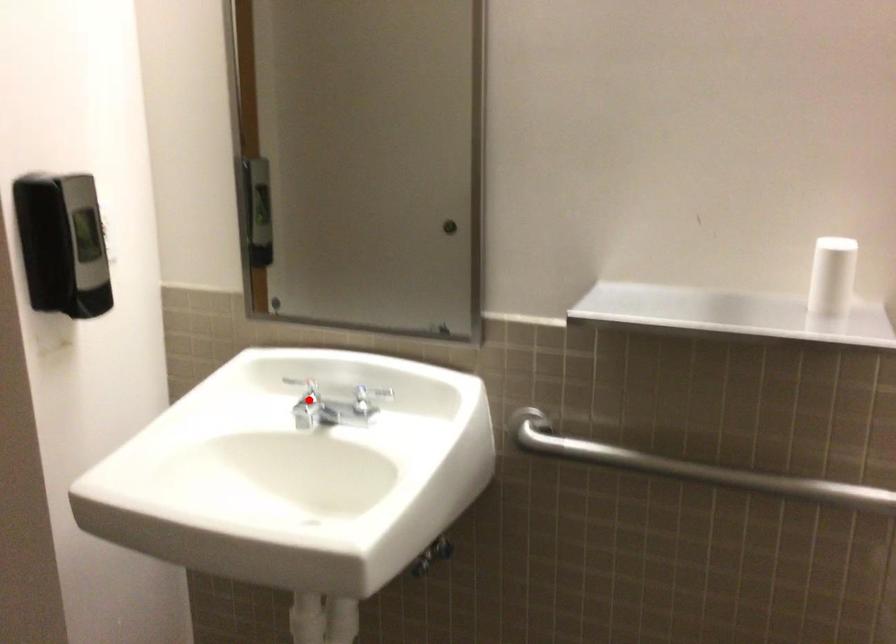
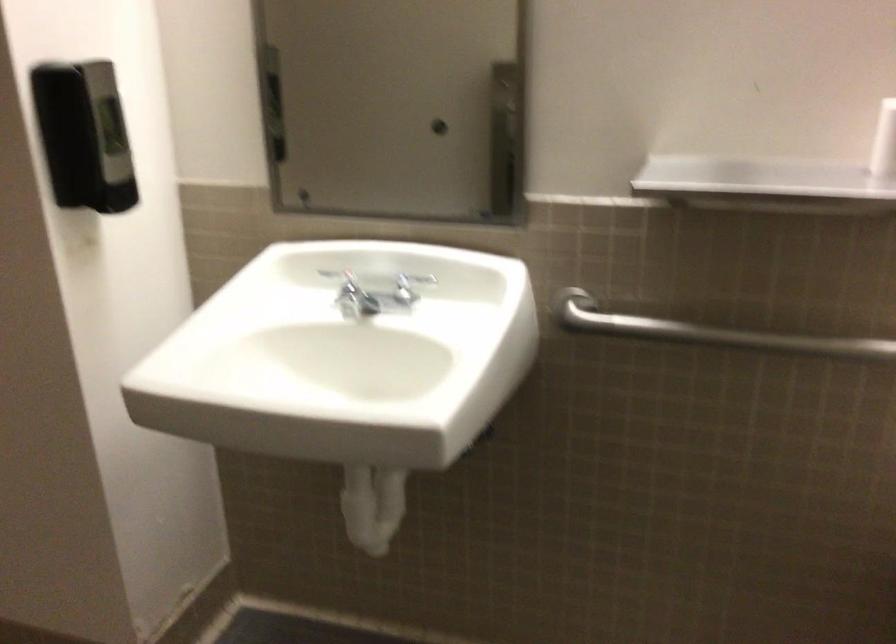
Where in the second image is the point corresponding to the highlighted location from the first image?

(346, 290)